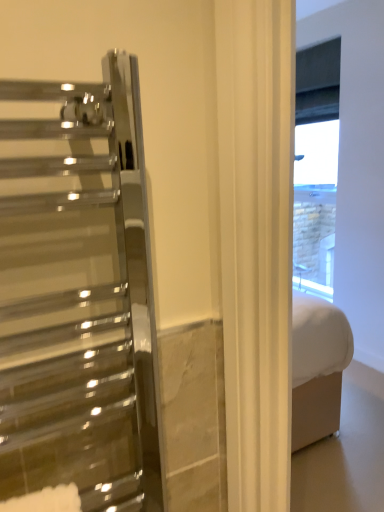
This screenshot has width=384, height=512. What are the coordinates of `white brick wall at upper right` in the screenshot? It's located at (316, 167).

What do you see at coordinates (316, 167) in the screenshot? The width and height of the screenshot is (384, 512). I see `white brick wall at upper right` at bounding box center [316, 167].

You are a GUI agent. You are given a task and a screenshot of the screen. Output one action in this format:
    pyautogui.click(x=<x>, y=<y>)
    Task: Click on the white brick wall at upper right
    The image size is (384, 512).
    Given the screenshot: What is the action you would take?
    pyautogui.click(x=316, y=167)